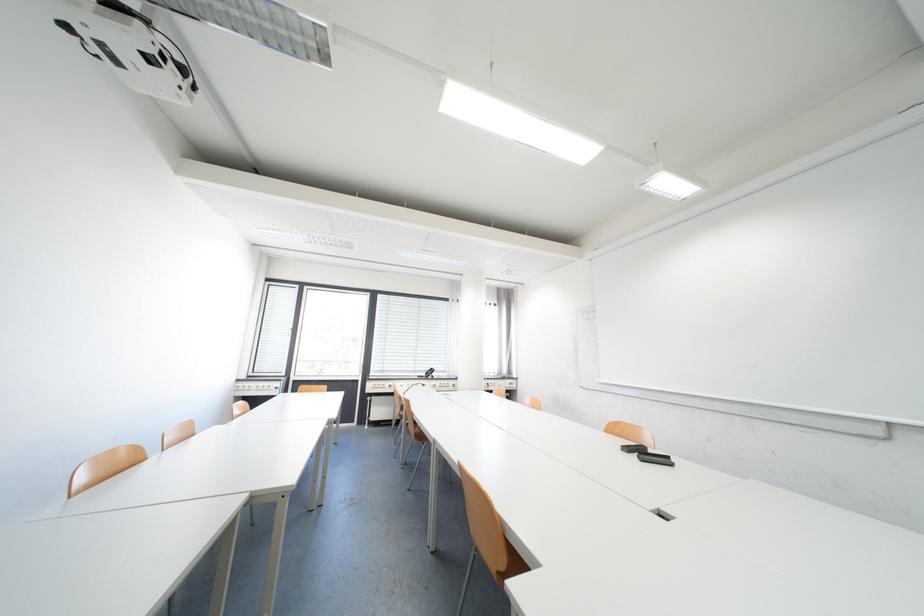
The height and width of the screenshot is (616, 924). What do you see at coordinates (508, 560) in the screenshot? I see `a orange chair sitting surface` at bounding box center [508, 560].